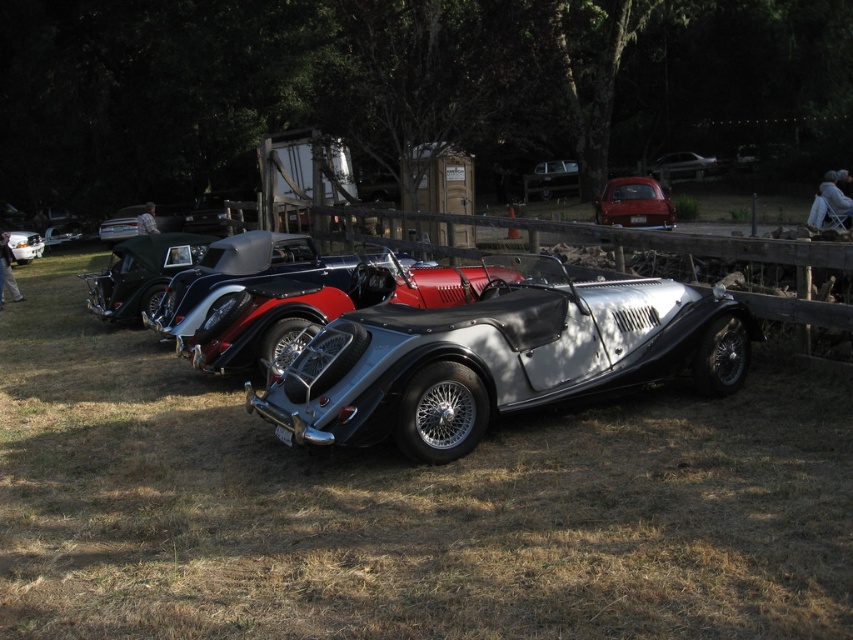
Does silver metallic convertible at center have a lesser height compared to matte black car at center?

Incorrect, silver metallic convertible at center's height does not fall short of matte black car at center's.

In the scene shown: Is silver metallic convertible at center further to camera compared to matte black car at center?

No, silver metallic convertible at center is closer to the viewer.

Is point (457, 397) closer to camera compared to point (30, 246)?

That is True.

In order to click on silver metallic convertible at center in this screenshot , I will do `click(498, 356)`.

Measure the distance between silver metallic convertible at center and camera.

A distance of 5.24 meters exists between silver metallic convertible at center and camera.

Who is more distant from viewer, (531, 339) or (706, 157)?

Positioned behind is point (706, 157).

Does point (572, 388) come behind point (676, 173)?

No.

Locate an element on the screen. Image resolution: width=853 pixels, height=640 pixels. silver metallic convertible at center is located at coordinates (498, 356).

This screenshot has width=853, height=640. What do you see at coordinates (634, 204) in the screenshot?
I see `metallic red car at center` at bounding box center [634, 204].

Who is more distant from viewer, (612, 193) or (33, 236)?

The point (33, 236) is more distant.

The width and height of the screenshot is (853, 640). I want to click on metallic red car at center, so click(x=634, y=204).